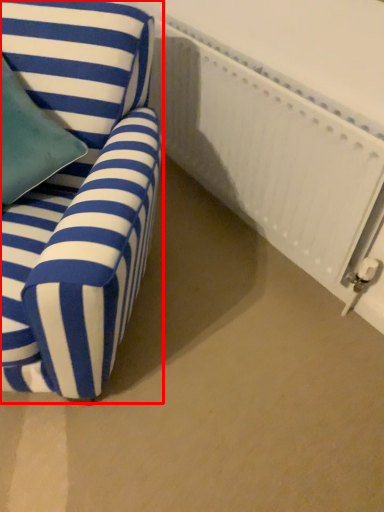
Question: From the image, what is the correct spatial relationship of chair (annotated by the red box) in relation to radiator?

Choices:
 (A) left
 (B) right

Answer: (A)